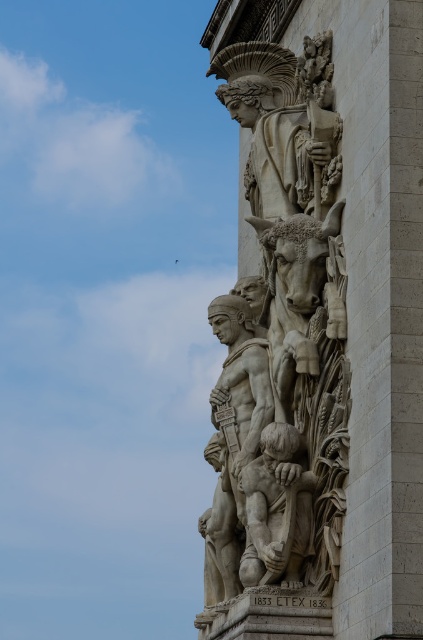
You are an art student standing in front of the stone structure. You need to sketch both the white stone sculpture at center and the matte stone child at center. Which one should you focus on first to capture their positions accurately?

You should focus on the white stone sculpture at center first because it is closer to the viewer than the matte stone child at center, making it appear larger and more prominent in the foreground.